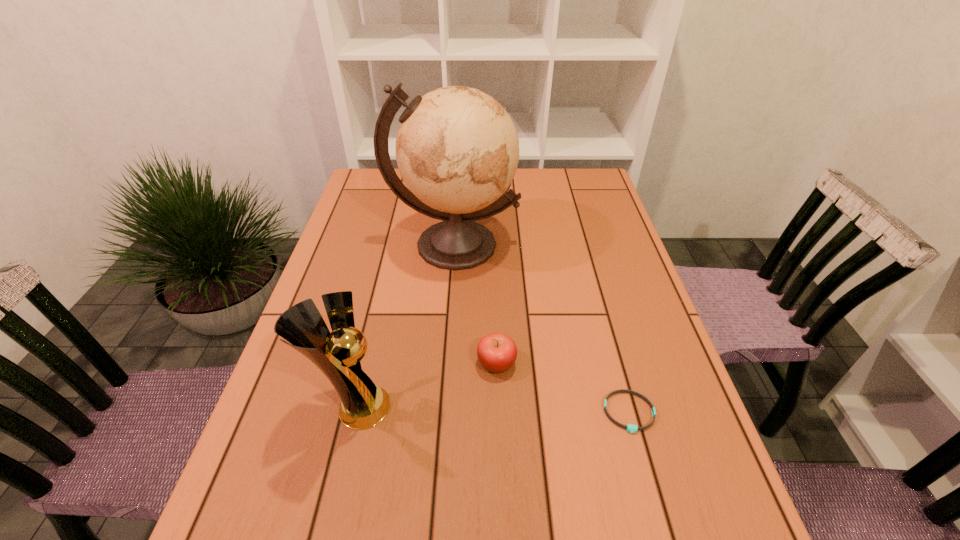
Where is `free space that satisfies the following two spatial constraints: 1. on the front-facing side of the tallest object; 2. at the front of the third shortest object, where the globe is visible`? This screenshot has width=960, height=540. free space that satisfies the following two spatial constraints: 1. on the front-facing side of the tallest object; 2. at the front of the third shortest object, where the globe is visible is located at coordinates (443, 407).

At what (x,y) coordinates should I click in order to perform the action: click on vacant space that satisfies the following two spatial constraints: 1. on the front-facing side of the apple; 2. on the right side of the globe. Please return your answer as a coordinate pair (x, y). Looking at the image, I should click on (445, 363).

Where is `blank space that satisfies the following two spatial constraints: 1. on the front-facing side of the apple; 2. on the right side of the globe`? The height and width of the screenshot is (540, 960). blank space that satisfies the following two spatial constraints: 1. on the front-facing side of the apple; 2. on the right side of the globe is located at coordinates (445, 363).

Where is `free region that satisfies the following two spatial constraints: 1. on the front side of the apple; 2. at the front of the award, where the globe is visible`? The height and width of the screenshot is (540, 960). free region that satisfies the following two spatial constraints: 1. on the front side of the apple; 2. at the front of the award, where the globe is visible is located at coordinates (498, 407).

Find the location of a particular element. This screenshot has width=960, height=540. blank area in the image that satisfies the following two spatial constraints: 1. on the front-facing side of the tallest object; 2. on the left side of the third tallest object is located at coordinates (445, 363).